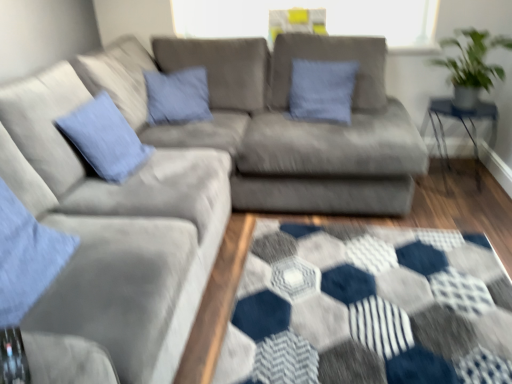
Question: In the image, is clear glass table at right on the left side or the right side of green leafy plant at upper right?

Choices:
 (A) left
 (B) right

Answer: (B)

Question: In the image, is clear glass table at right positioned in front of or behind green leafy plant at upper right?

Choices:
 (A) behind
 (B) front

Answer: (A)

Question: Estimate the real-world distances between objects in this image. Which object is closer to the clear glass table at right?

Choices:
 (A) green leafy plant at upper right
 (B) blue cotton pillow at left, the 1th pillow positioned from the left
 (C) blue cotton pillow at center, the second pillow when ordered from front to back

Answer: (A)

Question: Which of these objects is positioned farthest from the green leafy plant at upper right?

Choices:
 (A) blue cotton pillow at center, positioned as the 1th pillow in back-to-front order
 (B) blue cotton pillow at left, the 2th pillow viewed from the right
 (C) clear glass table at right

Answer: (B)